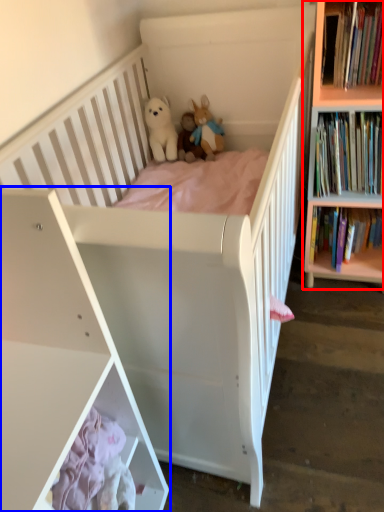
Question: Which of the following is the closest to the observer, bookcase (highlighted by a red box) or shelf (highlighted by a blue box)?

Choices:
 (A) bookcase
 (B) shelf

Answer: (B)